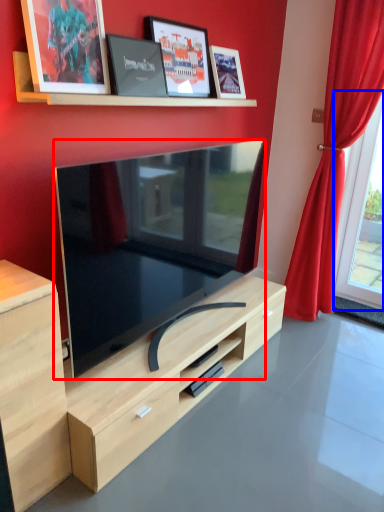
Question: Which point is closer to the camera, television (highlighted by a red box) or window (highlighted by a blue box)?

Choices:
 (A) television
 (B) window

Answer: (A)